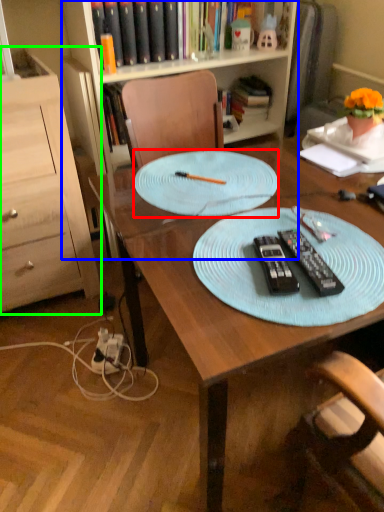
Question: Which object is positioned closest to glass plate (highlighted by a red box)? Select from bookcase (highlighted by a blue box) and cabinetry (highlighted by a green box).

Choices:
 (A) bookcase
 (B) cabinetry

Answer: (B)